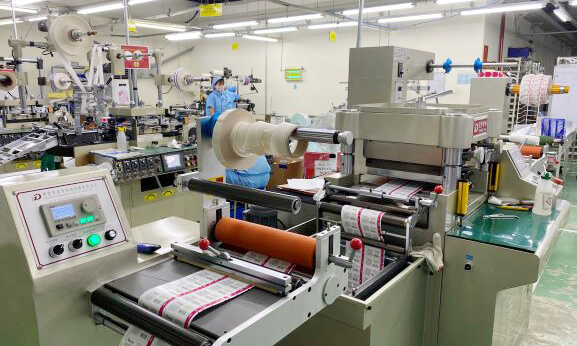
Identify the location of yellow plaque hanging from ceiling. (208, 10), (332, 36), (236, 47), (132, 26).